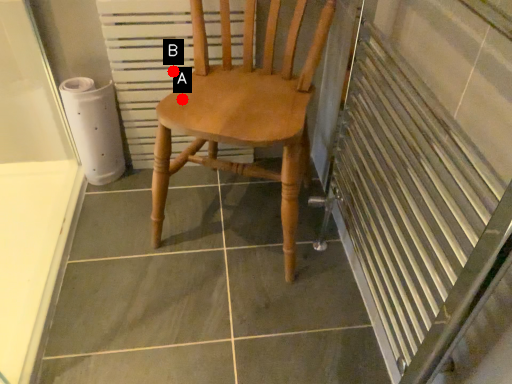
Question: Two points are circled on the image, labeled by A and B beside each circle. Which point is closer to the camera?

Choices:
 (A) A is closer
 (B) B is closer

Answer: (A)